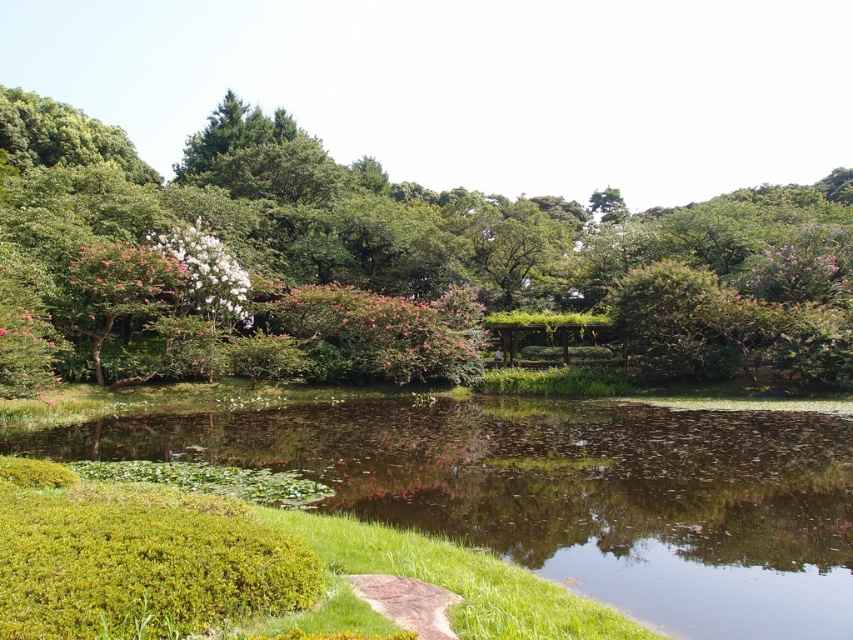
Question: From the image, what is the correct spatial relationship of green leafy tree at center in relation to green grassy lake at lower left?

Choices:
 (A) below
 (B) above

Answer: (B)

Question: Can you confirm if green leafy tree at center is positioned above green grassy lake at lower left?

Choices:
 (A) yes
 (B) no

Answer: (A)

Question: Which of the following is the farthest from the observer?

Choices:
 (A) (610, 477)
 (B) (830, 188)

Answer: (B)

Question: Which object is farther from the camera taking this photo?

Choices:
 (A) green leafy tree at center
 (B) green grassy lake at lower left

Answer: (A)

Question: From the image, what is the correct spatial relationship of green leafy tree at center in relation to green grassy lake at lower left?

Choices:
 (A) right
 (B) left

Answer: (A)

Question: Among these points, which one is farthest from the camera?

Choices:
 (A) (805, 572)
 (B) (259, 145)

Answer: (B)